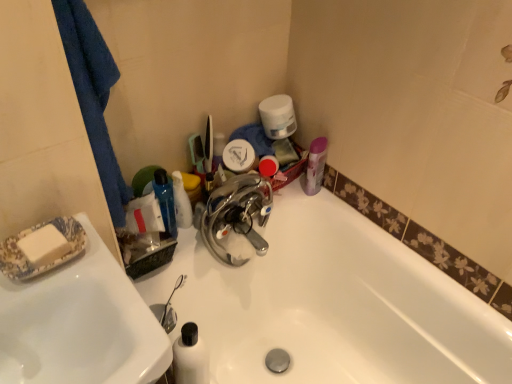
Question: Is white glossy bottle at upper center not within white glossy sink at left?

Choices:
 (A) yes
 (B) no

Answer: (A)

Question: From the image's perspective, is white glossy bottle at upper center located beneath white glossy sink at left?

Choices:
 (A) yes
 (B) no

Answer: (B)

Question: Does white glossy bottle at upper center have a greater height compared to white glossy sink at left?

Choices:
 (A) yes
 (B) no

Answer: (B)

Question: Does white glossy bottle at upper center have a lesser height compared to white glossy sink at left?

Choices:
 (A) yes
 (B) no

Answer: (A)

Question: From the image's perspective, is white glossy bottle at upper center over white glossy sink at left?

Choices:
 (A) yes
 (B) no

Answer: (A)

Question: From a real-world perspective, is white glossy bottle at upper center positioned under white glossy sink at left based on gravity?

Choices:
 (A) yes
 (B) no

Answer: (B)

Question: Are blue fabric towel at left and white glossy sink at left far apart?

Choices:
 (A) yes
 (B) no

Answer: (B)

Question: Is blue fabric towel at left taller than white glossy sink at left?

Choices:
 (A) yes
 (B) no

Answer: (A)

Question: Is blue fabric towel at left shorter than white glossy sink at left?

Choices:
 (A) no
 (B) yes

Answer: (A)

Question: From a real-world perspective, does blue fabric towel at left sit lower than white glossy sink at left?

Choices:
 (A) yes
 (B) no

Answer: (B)

Question: Is blue fabric towel at left to the left of white glossy sink at left from the viewer's perspective?

Choices:
 (A) yes
 (B) no

Answer: (B)

Question: From the image's perspective, is blue fabric towel at left above white glossy sink at left?

Choices:
 (A) yes
 (B) no

Answer: (A)

Question: Is blue fabric towel at left aimed at white glossy bottle at upper center?

Choices:
 (A) no
 (B) yes

Answer: (A)